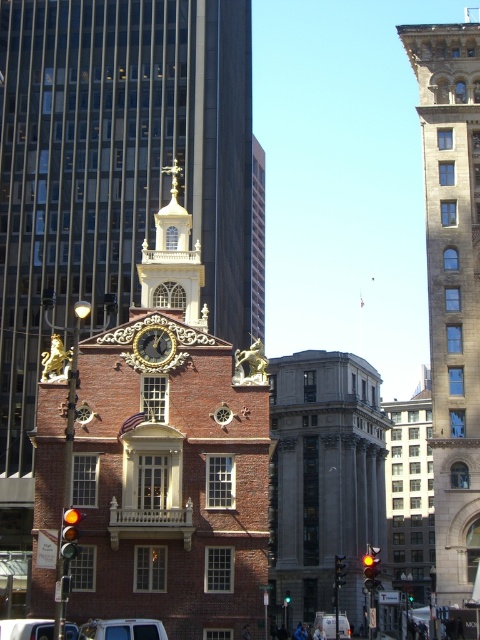
You are a delivery driver who needs to park your vehicle in a tight space near the historic brick building. You have two options for parking spots next to the metallic silver van at lower center and the white matte van at center. Which van should you choose to park next to if you want to minimize the space taken by your vehicle?

You should park next to the metallic silver van at lower center because it occupies less space than the white matte van at center, allowing for more room in the tight parking area.

You are a photographer standing in the middle of the street. You want to take a photo of the stone tower at right and the white matte van at center. Based on their heights, which object will appear larger in the photo?

The stone tower at right is taller than the white matte van at center, so it will appear larger in the photo.

You are standing at the point closest to the historic brick building. Which point, point (x=156, y=353) or point (x=47, y=628), is farther away from you?

Point (x=156, y=353) is farther away from you because it is behind point (x=47, y=628).